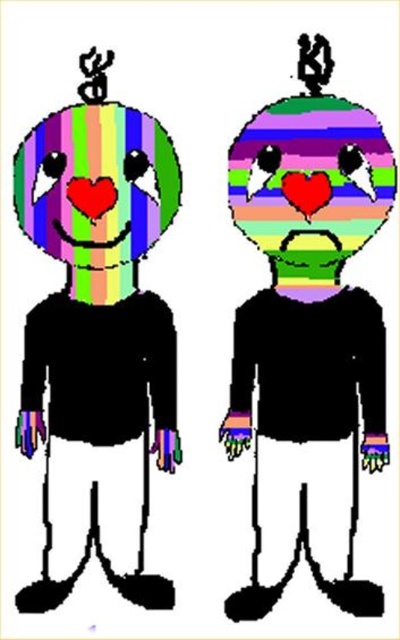
Question: Is striped rubber heart at center positioned in front of rainbow striped face at center?

Choices:
 (A) yes
 (B) no

Answer: (A)

Question: Is striped rubber heart at center to the left of rainbow striped face at center from the viewer's perspective?

Choices:
 (A) yes
 (B) no

Answer: (B)

Question: Can you confirm if striped rubber heart at center is smaller than rainbow striped face at center?

Choices:
 (A) yes
 (B) no

Answer: (B)

Question: Among these objects, which one is farthest from the camera?

Choices:
 (A) striped rubber heart at center
 (B) rainbow striped face at center

Answer: (B)

Question: Which object is closer to the camera taking this photo?

Choices:
 (A) rainbow striped face at center
 (B) striped rubber heart at center

Answer: (B)